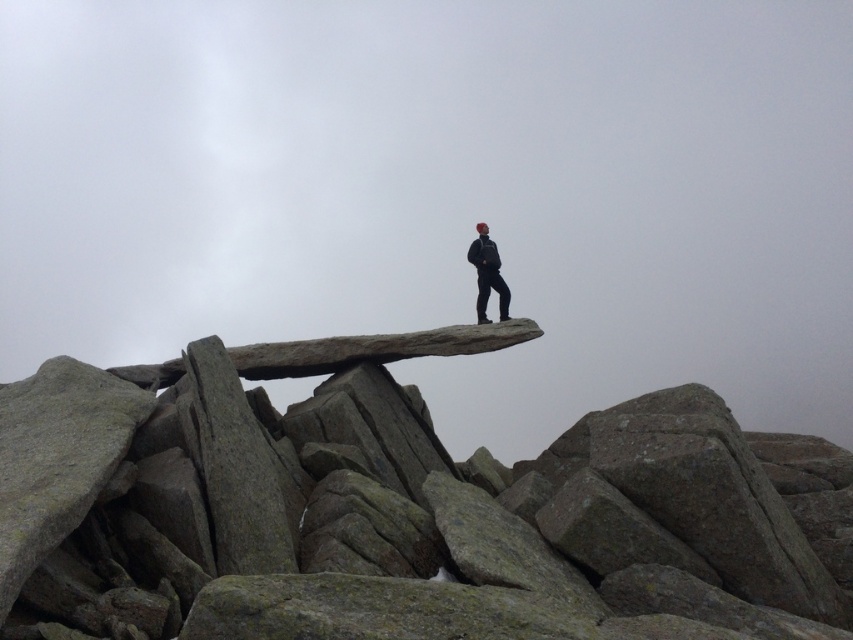
You are a hiker trying to cross the gray granite rock at center. Your dark gray fabric jacket at center is hanging loosely on your shoulders. Do you think the rock is wide enough for you to walk across without the jacket falling off?

The gray granite rock at center might be wider than dark gray fabric jacket at center, so it is possible that the rock is wide enough to walk across without the jacket slipping off. However, the uncertainty in the description suggests there is a chance the jacket could still move depending on how you walk.